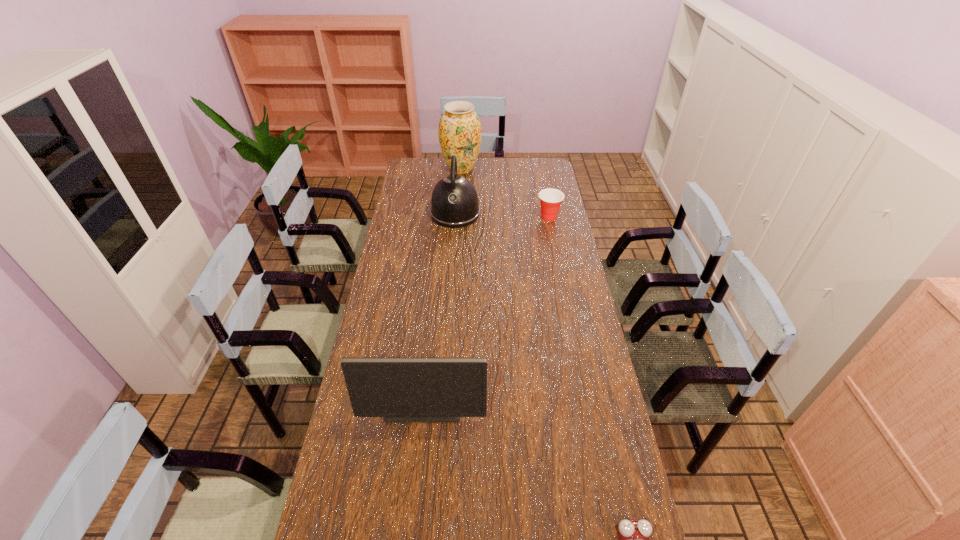
Identify the location of unoccupied position between the kettle and the cup. (502, 215).

Where is `object that can be found as the third closest to the alarm clock`? object that can be found as the third closest to the alarm clock is located at coordinates (550, 199).

Identify which object is the third closest to the computer monitor. Please provide its 2D coordinates. Your answer should be formatted as a tuple, i.e. [(x, y)], where the tuple contains the x and y coordinates of a point satisfying the conditions above.

[(550, 199)]